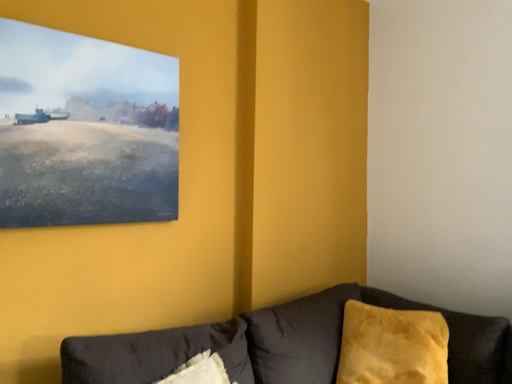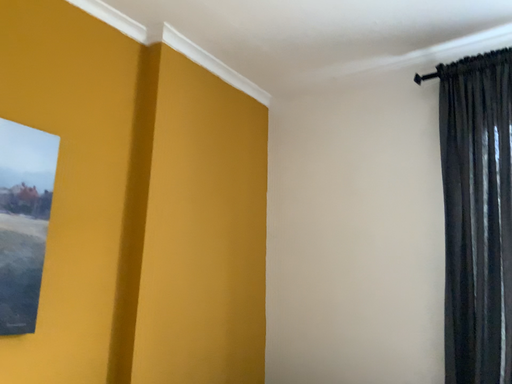
Question: How did the camera likely rotate when shooting the video?

Choices:
 (A) rotated downward
 (B) rotated upward

Answer: (B)